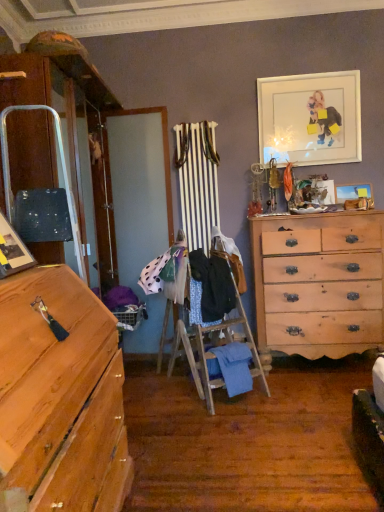
Where is `blank space above wooden picture frame at upper right, placed as the 1th picture frame when sorted from right to left (from a real-world perspective)`? The height and width of the screenshot is (512, 384). blank space above wooden picture frame at upper right, placed as the 1th picture frame when sorted from right to left (from a real-world perspective) is located at coordinates (360, 174).